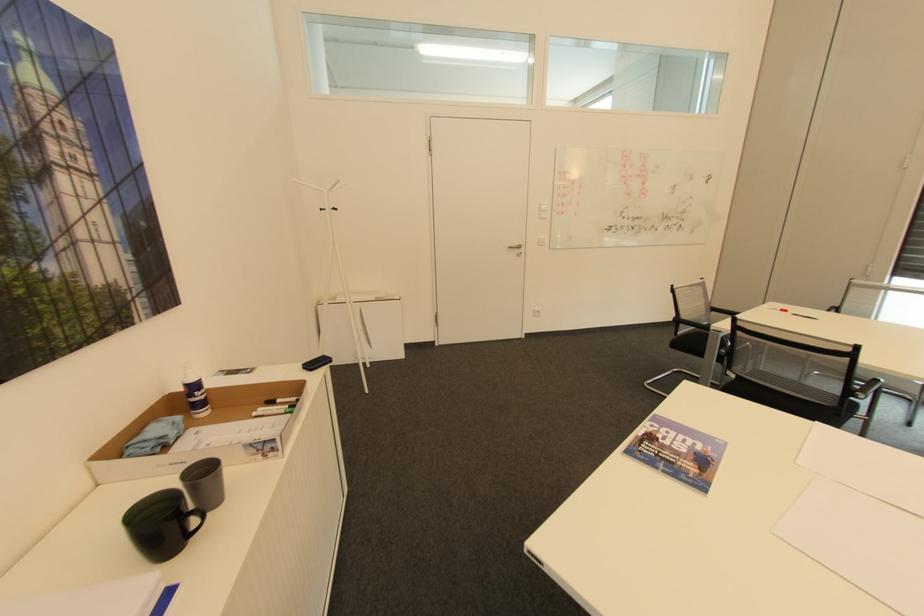
Identify the location of black cup handle. (193, 521).